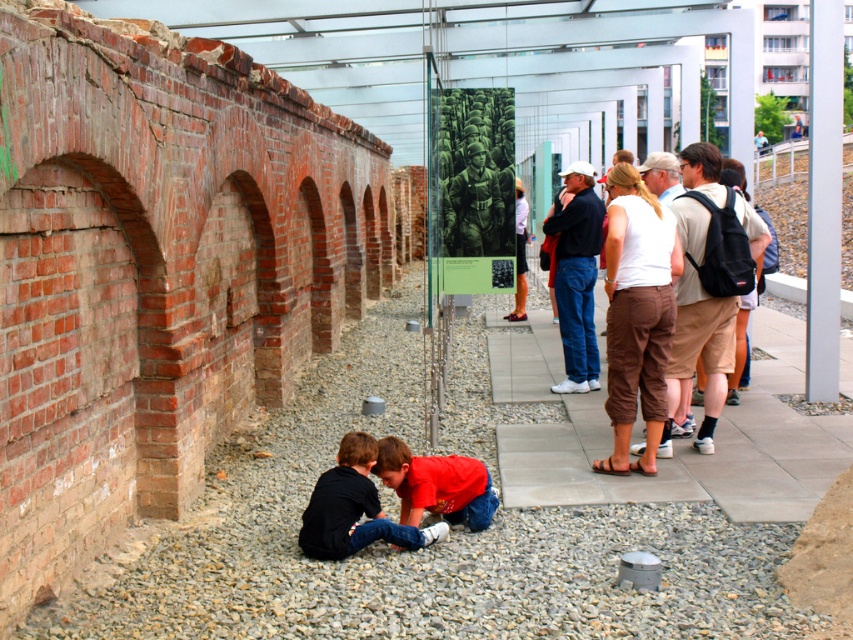
You are standing in the outdoor exhibit area and notice a black cotton shirt at lower center. If you want to take a closer look at the shirt, which direction should you move relative to your current position?

The black cotton shirt at lower center is located at point 0.794 on the x axis and 0.415 on the y axis. Since the shirt is at lower center, you should move forward slightly to the right to reach it.

You are a visitor standing in front of the exhibit area and want to touch both the gray gravel at lower center and the black cotton shirt at lower center. Which object will you reach first?

The gray gravel at lower center is closer to you than the black cotton shirt at lower center, so you will reach the gray gravel at lower center first.

You are standing at the entrance of the outdoor exhibit area. You want to take a photo of the point at coordinates point (344, 500). Your camera has a maximum focus range of 15 feet. Will you be able to focus on the point?

The distance of point (344, 500) from the camera is 15.72 feet, which exceeds the camera maximum focus range of 15 feet. Therefore, the camera cannot focus on the point.